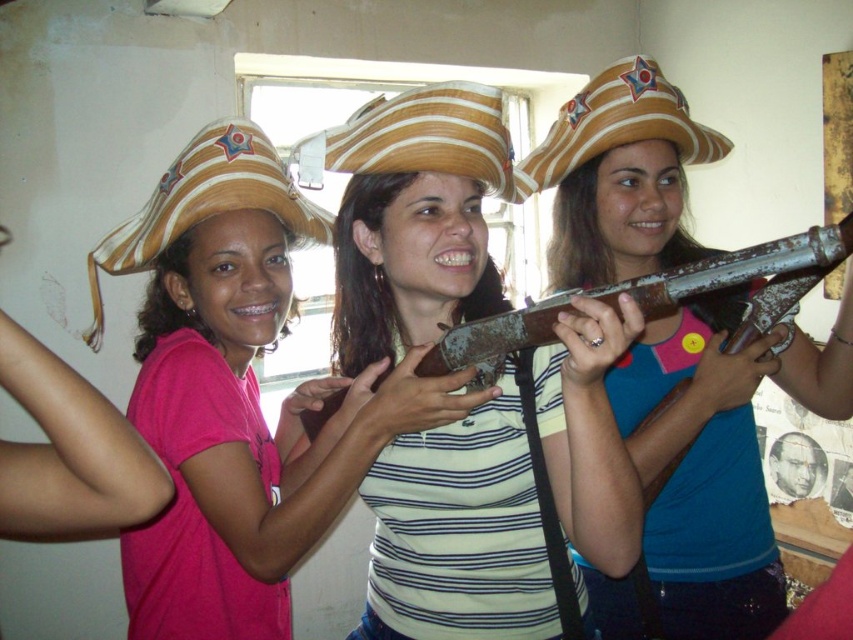
You are a photographer setting up a photo shoot with the three people holding the matte brown rifle at center and wearing the matte brown hat at center. You need to adjust the camera angle so that the rifle and hat are both visible in the frame. Since the rifle is shorter than the hat, which object should you ensure is closer to the camera to maintain their apparent sizes in the photo?

Since the matte brown rifle at center is shorter than the matte brown hat at center, you should position the rifle closer to the camera to make it appear the same size as the hat in the photo.

You are a photographer standing at the position of the camera. You want to take a photo of the straw cowboy hat at left. Can you reach the hat with your hand to adjust it without moving from your current position? Assume your arm can extend 1 meter.

The straw cowboy hat at left and camera are 1.29 meters apart. Since your arm can only extend 1 meter, you cannot reach the hat without moving from your current position.

You are a photographer trying to capture a group photo of three people holding a rusty metal shotgun at center. The three people are standing 33.66 inches apart from each other. If the minimum recommended distance for a standard camera lens to avoid distortion is 36 inches, will you be able to take the photo without distortion?

The three people are standing 33.66 inches apart, which is less than the minimum recommended distance of 36 inches. Therefore, taking the photo without distortion may not be possible with the current setup.